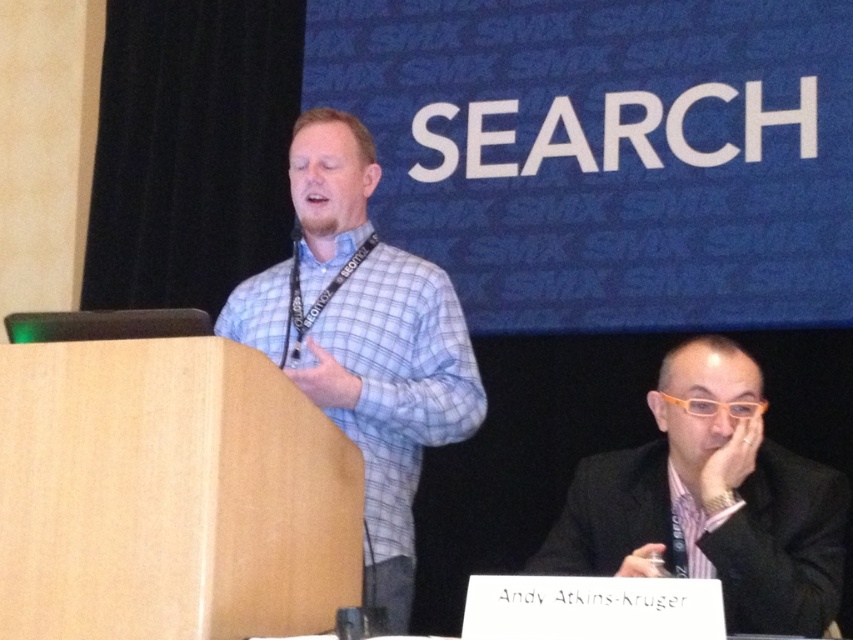
You are attending a conference and need to locate the speaker who is wearing the blue checkered shirt at center. From your seat at the back, which direction should you look to find the speaker relative to the black suit at lower right?

The blue checkered shirt at center is located above the black suit at lower right, so you should look upward from the black suit at lower right to find the speaker.

You are standing at the front of the conference room and want to reach the point marked at coordinates point (337, 364). If your stride length is 0.75 meters per step, how many steps will it take you to reach that point?

The distance between you and point (337, 364) is 2.69 meters. Dividing the total distance by your stride length of 0.75 meters per step gives approximately 3.59 steps. Since you can only take whole steps, you will need 4 steps to reach the point.